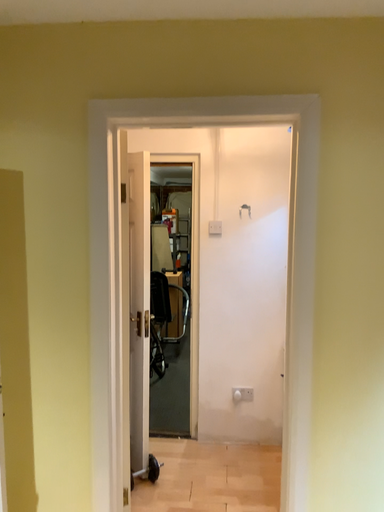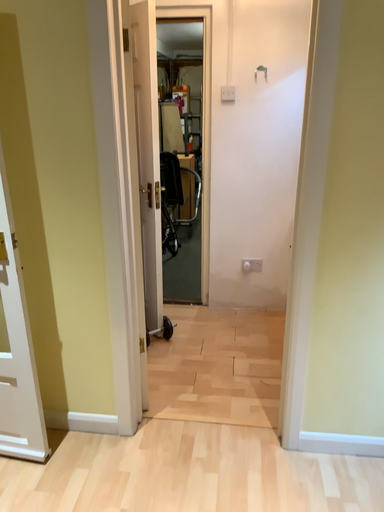
Question: Which way did the camera rotate in the video?

Choices:
 (A) rotated downward
 (B) rotated upward

Answer: (A)